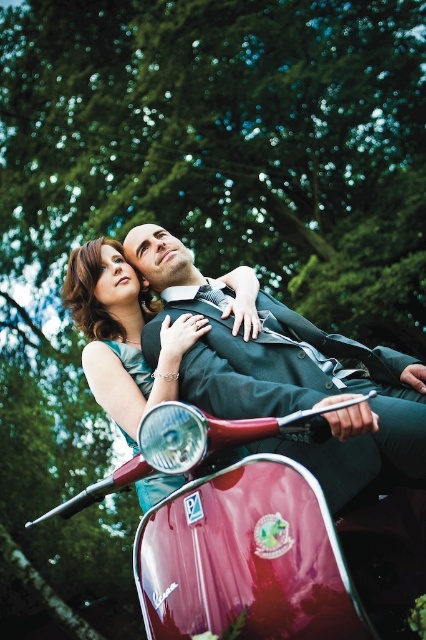
Can you confirm if glossy red scooter at center is positioned to the right of shiny black suit at center?

No, glossy red scooter at center is not to the right of shiny black suit at center.

Does glossy red scooter at center have a lesser height compared to shiny black suit at center?

Yes, glossy red scooter at center is shorter than shiny black suit at center.

At what (x,y) coordinates should I click in order to perform the action: click on glossy red scooter at center. Please return your answer as a coordinate pair (x, y). This screenshot has height=640, width=426. Looking at the image, I should click on (247, 561).

Does shiny black suit at center have a lesser height compared to satin teal dress at lower left?

No, shiny black suit at center is not shorter than satin teal dress at lower left.

Does shiny black suit at center appear on the right side of satin teal dress at lower left?

Yes, shiny black suit at center is to the right of satin teal dress at lower left.

Is point (336, 355) less distant than point (124, 349)?

Yes, point (336, 355) is in front of point (124, 349).

Locate an element on the screen. shiny black suit at center is located at coordinates (287, 374).

Does glossy red scooter at center have a larger size compared to satin teal dress at lower left?

Yes, glossy red scooter at center is bigger than satin teal dress at lower left.

Can you confirm if glossy red scooter at center is wider than satin teal dress at lower left?

Yes.

Which is in front, point (310, 602) or point (131, 444)?

Point (310, 602) is more forward.

The height and width of the screenshot is (640, 426). I want to click on glossy red scooter at center, so click(247, 561).